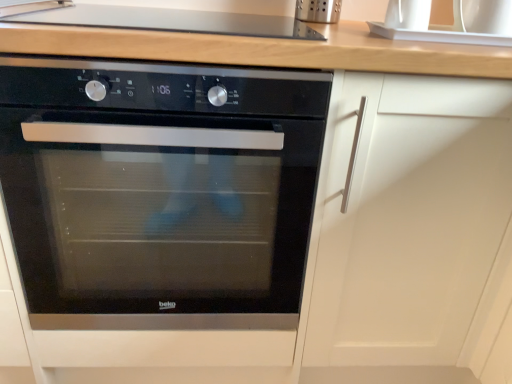
Find the location of a particular element. The height and width of the screenshot is (384, 512). smooth glass cooktop at upper center is located at coordinates (170, 21).

The height and width of the screenshot is (384, 512). Identify the location of black glass oven at center. (160, 191).

At what (x,y) coordinates should I click in order to perform the action: click on gas stove that appears on the right of black glass oven at center. Please return your answer as a coordinate pair (x, y). Looking at the image, I should click on (170, 21).

Can you confirm if smooth glass cooktop at upper center is shorter than black glass oven at center?

Yes, smooth glass cooktop at upper center is shorter than black glass oven at center.

Which of these two, smooth glass cooktop at upper center or black glass oven at center, is wider?

black glass oven at center is wider.

Does black glass oven at center turn towards smooth glass cooktop at upper center?

No, black glass oven at center is not oriented towards smooth glass cooktop at upper center.

Is black glass oven at center wider than smooth glass cooktop at upper center?

Yes.

Which of these two, black glass oven at center or smooth glass cooktop at upper center, is bigger?

black glass oven at center is bigger.

Between point (18, 82) and point (297, 26), which one is positioned behind?

The point (297, 26) is farther from the camera.

Between white glossy sink at upper right and smooth glass cooktop at upper center, which one appears on the left side from the viewer's perspective?

smooth glass cooktop at upper center is more to the left.

Can you confirm if white glossy sink at upper right is taller than smooth glass cooktop at upper center?

No, white glossy sink at upper right is not taller than smooth glass cooktop at upper center.

Are white glossy sink at upper right and smooth glass cooktop at upper center far apart?

white glossy sink at upper right is near smooth glass cooktop at upper center, not far away.

Does point (262, 246) lie in front of point (392, 23)?

No, it is behind (392, 23).

Locate an element on the screen. sink above the black glass oven at center (from the image's perspective) is located at coordinates (449, 26).

Does black glass oven at center lie behind white glossy sink at upper right?

No, black glass oven at center is closer to the camera.

From a real-world perspective, relative to white glossy sink at upper right, is smooth glass cooktop at upper center vertically above or below?

A: In terms of real-world spatial position, smooth glass cooktop at upper center is below white glossy sink at upper right.

From the image's perspective, is smooth glass cooktop at upper center positioned above or below white glossy sink at upper right?

Based on their image positions, smooth glass cooktop at upper center is located above white glossy sink at upper right.

Is smooth glass cooktop at upper center positioned far away from white glossy sink at upper right?

No, smooth glass cooktop at upper center is not far from white glossy sink at upper right.

Based on the photo, visually, is white glossy sink at upper right positioned to the left or to the right of black glass oven at center?

From the image, it's evident that white glossy sink at upper right is to the right of black glass oven at center.

From a real-world perspective, is white glossy sink at upper right positioned over black glass oven at center based on gravity?

Yes.

Who is taller, white glossy sink at upper right or black glass oven at center?

With more height is black glass oven at center.

At what (x,y) coordinates should I click in order to perform the action: click on gas stove above the black glass oven at center (from the image's perspective). Please return your answer as a coordinate pair (x, y). The height and width of the screenshot is (384, 512). Looking at the image, I should click on (170, 21).

You are a GUI agent. You are given a task and a screenshot of the screen. Output one action in this format:
    pyautogui.click(x=<x>, y=<y>)
    Task: Click on the oven lying below the smooth glass cooktop at upper center (from the image's perspective)
    
    Given the screenshot: What is the action you would take?
    pyautogui.click(x=160, y=191)

From the image, which object appears to be nearer to white glossy sink at upper right, black glass oven at center or smooth glass cooktop at upper center?

smooth glass cooktop at upper center is positioned closer to the anchor white glossy sink at upper right.

From the picture: From the image, which object appears to be farther from smooth glass cooktop at upper center, black glass oven at center or white glossy sink at upper right?

Among the two, black glass oven at center is located further to smooth glass cooktop at upper center.

Looking at the image, which one is located further to black glass oven at center, smooth glass cooktop at upper center or white glossy sink at upper right?

Based on the image, white glossy sink at upper right appears to be further to black glass oven at center.

Which object lies nearer to the anchor point black glass oven at center, white glossy sink at upper right or smooth glass cooktop at upper center?

smooth glass cooktop at upper center.

From the picture: When comparing their distances from smooth glass cooktop at upper center, does white glossy sink at upper right or black glass oven at center seem closer?

white glossy sink at upper right is closer to smooth glass cooktop at upper center.

Based on their spatial positions, is smooth glass cooktop at upper center or black glass oven at center closer to white glossy sink at upper right?

Among the two, smooth glass cooktop at upper center is located nearer to white glossy sink at upper right.

The height and width of the screenshot is (384, 512). In order to click on gas stove situated between black glass oven at center and white glossy sink at upper right from left to right in this screenshot , I will do `click(170, 21)`.